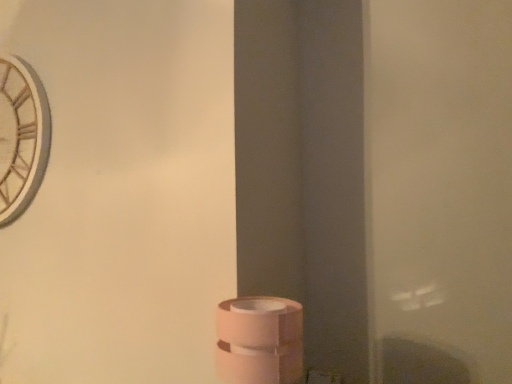
Question: Is wooden clock at upper left bigger or smaller than pink matte toilet paper at lower center?

Choices:
 (A) small
 (B) big

Answer: (B)

Question: From the image's perspective, is wooden clock at upper left above or below pink matte toilet paper at lower center?

Choices:
 (A) below
 (B) above

Answer: (B)

Question: In the image, is wooden clock at upper left on the left side or the right side of pink matte toilet paper at lower center?

Choices:
 (A) left
 (B) right

Answer: (A)

Question: Would you say pink matte toilet paper at lower center is inside or outside wooden clock at upper left?

Choices:
 (A) outside
 (B) inside

Answer: (A)

Question: Is point (293, 304) closer or farther from the camera than point (14, 162)?

Choices:
 (A) closer
 (B) farther

Answer: (A)

Question: Is pink matte toilet paper at lower center to the left or to the right of wooden clock at upper left in the image?

Choices:
 (A) left
 (B) right

Answer: (B)

Question: In the image, is pink matte toilet paper at lower center positioned in front of or behind wooden clock at upper left?

Choices:
 (A) front
 (B) behind

Answer: (A)